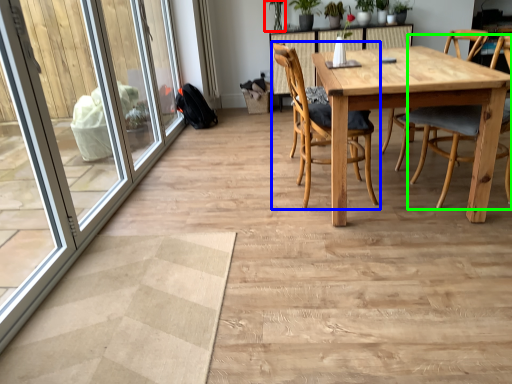
Question: Which object is the farthest from plant (highlighted by a red box)? Choose among these: chair (highlighted by a blue box) or chair (highlighted by a green box).

Choices:
 (A) chair
 (B) chair

Answer: (B)